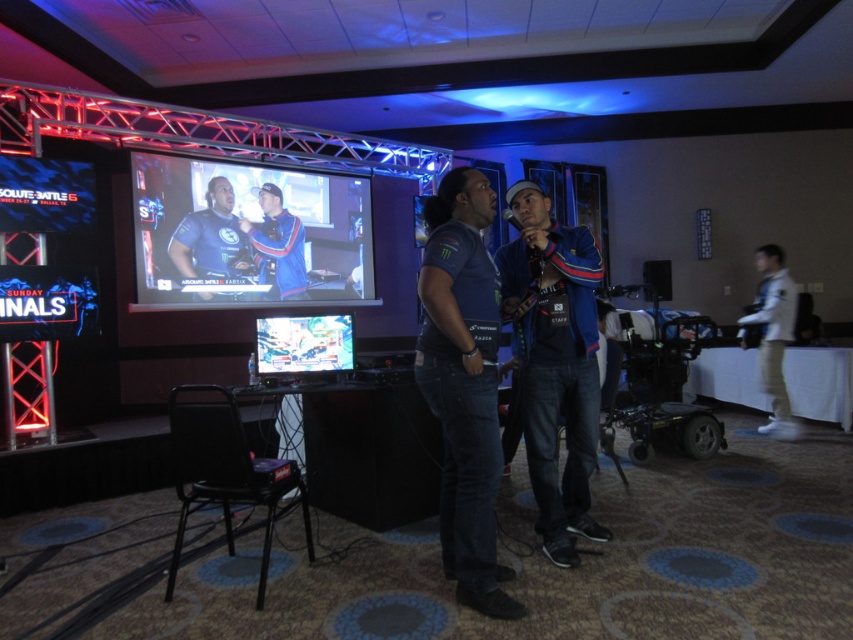
Is denim jacket at center positioned before shiny plastic monitor at center?

Yes, it is.

Does denim jacket at center appear on the left side of shiny plastic monitor at center?

Incorrect, denim jacket at center is not on the left side of shiny plastic monitor at center.

Is point (593, 321) positioned before point (310, 353)?

Yes, it is.

Where is `denim jacket at center`? The height and width of the screenshot is (640, 853). denim jacket at center is located at coordinates (554, 362).

Describe the element at coordinates (247, 234) in the screenshot. The image size is (853, 640). I see `matte black monitor at center` at that location.

Between point (283, 170) and point (302, 328), which one is positioned in front?

Point (302, 328)

The height and width of the screenshot is (640, 853). Find the location of `matte black monitor at center`. matte black monitor at center is located at coordinates (247, 234).

Find the location of a particular element. matte black monitor at center is located at coordinates (247, 234).

Consider the image. Measure the distance from dark blue denim jeans at center to denim jacket at center.

dark blue denim jeans at center is 16.72 inches away from denim jacket at center.

Is point (477, 332) positioned before point (589, 420)?

Yes, point (477, 332) is closer to viewer.

The width and height of the screenshot is (853, 640). What are the coordinates of `dark blue denim jeans at center` in the screenshot? It's located at point(463,385).